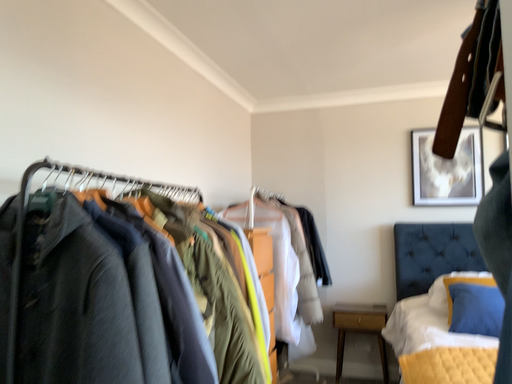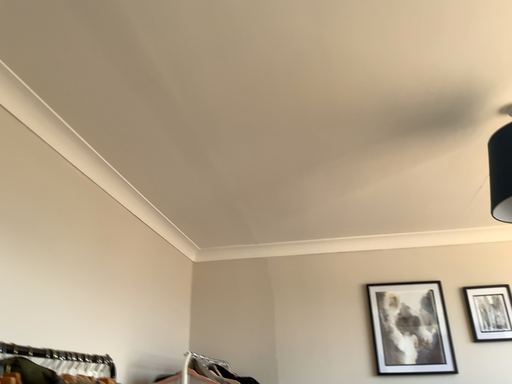
Question: Which way did the camera rotate in the video?

Choices:
 (A) rotated upward
 (B) rotated downward

Answer: (A)